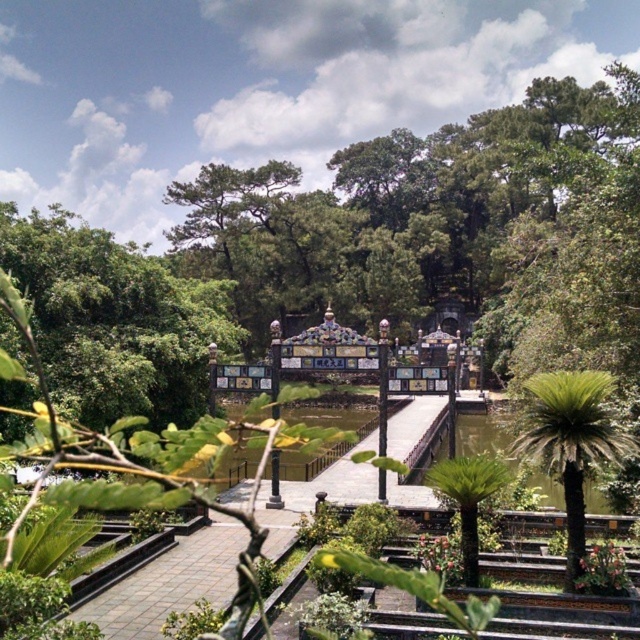
You are standing at the entrance of the garden and see the green leafy tree at center and the green leafy palm trees at center. Which one is positioned to the left?

The green leafy tree at center is positioned to the left of the green leafy palm trees at center.

You are a landscape architect designing a garden layout. You need to place a statue that requires a tall tree to cast shade. Which of the two trees, the green leafy tree at center or the green leafy palm trees at center, should you choose for the statue to be under?

The green leafy tree at center has a greater height compared to the green leafy palm trees at center, so the statue should be placed under the green leafy tree at center to ensure sufficient shade.